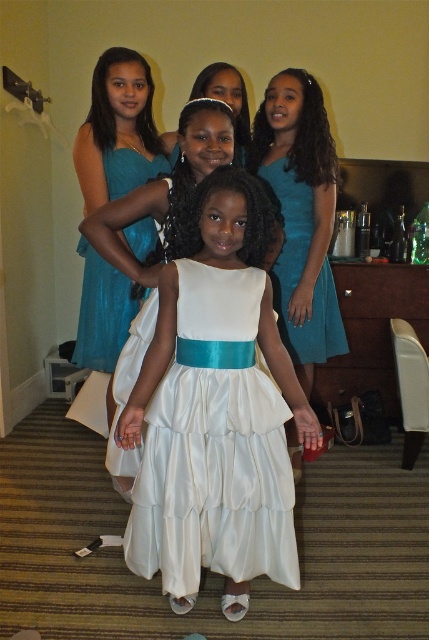
You are a photographer setting up for a group photo. You notice two dresses in the scene, the white satin dress at center and the teal satin dress at center. Which dress has a wider silhouette?

The white satin dress at center has a wider silhouette than the teal satin dress at center, as its width surpasses the teal satin dress at center.